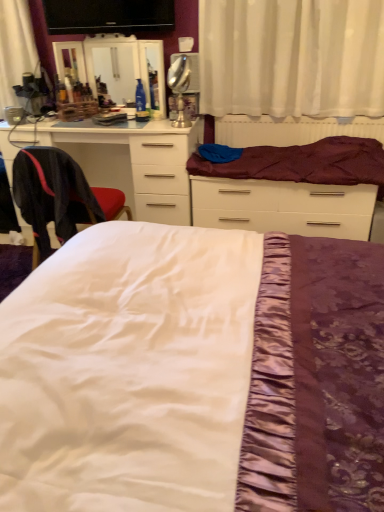
Where is `vacant space situated on the left part of silver metallic table lamp at upper center`? The image size is (384, 512). vacant space situated on the left part of silver metallic table lamp at upper center is located at coordinates (159, 128).